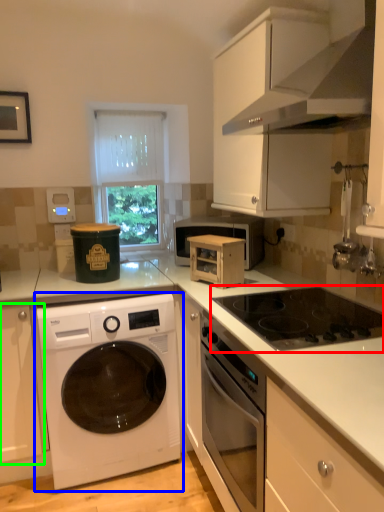
Question: Which is nearer to the gas stove (highlighted by a red box)? washing machine (highlighted by a blue box) or cabinetry (highlighted by a green box).

Choices:
 (A) washing machine
 (B) cabinetry

Answer: (A)